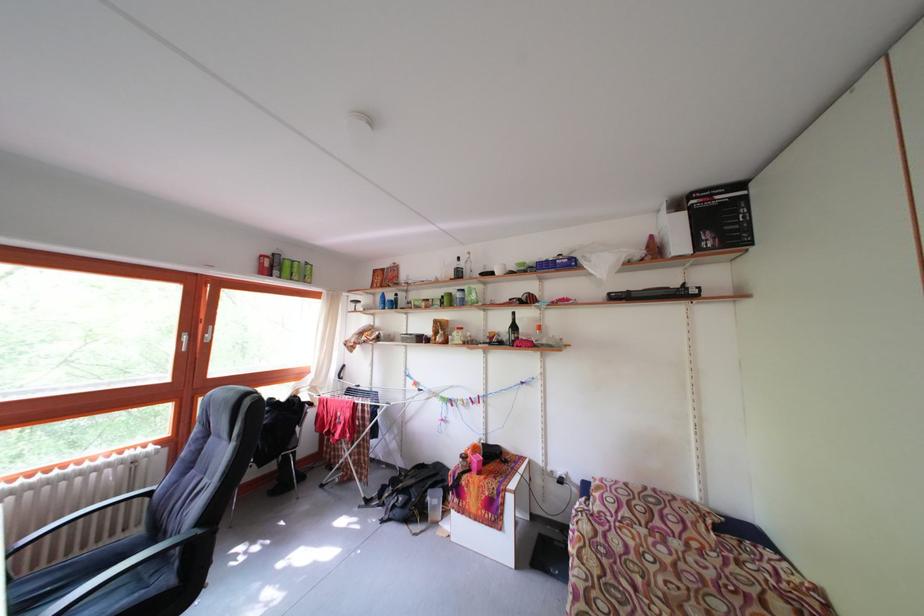
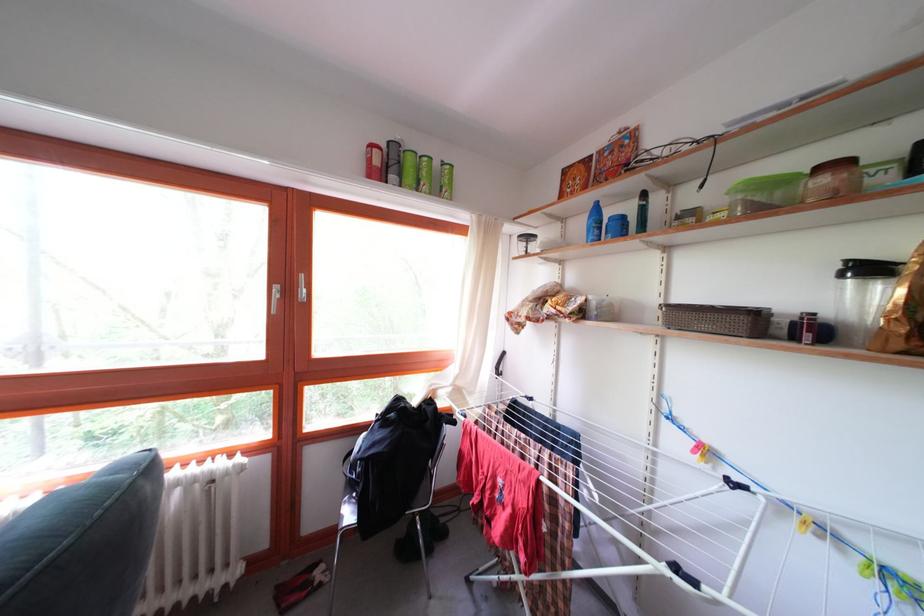
The point at (432,310) is marked in the first image. Where is the corresponding point in the second image?

(832, 187)